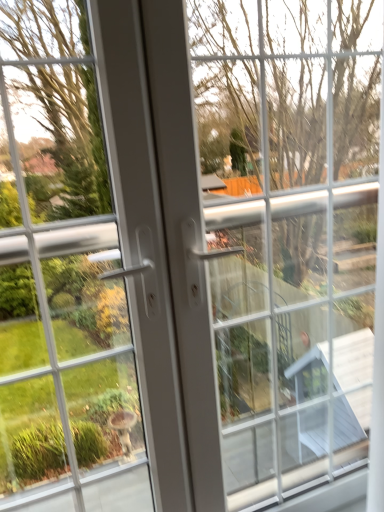
Describe the element at coordinates (61, 280) in the screenshot. The height and width of the screenshot is (512, 384). I see `white plastic door at center` at that location.

Image resolution: width=384 pixels, height=512 pixels. I want to click on white plastic door at center, so click(61, 280).

You are a GUI agent. You are given a task and a screenshot of the screen. Output one action in this format:
    pyautogui.click(x=<x>, y=<y>)
    Task: Click on the white plastic door at center
    
    Given the screenshot: What is the action you would take?
    pos(61,280)